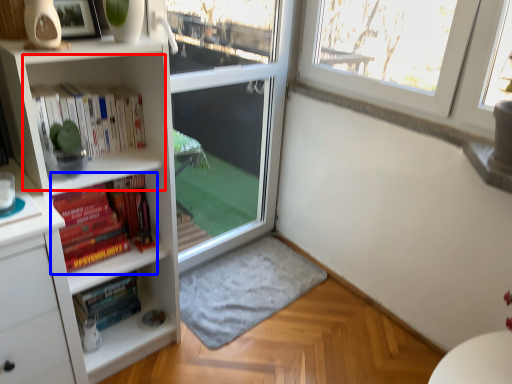
Question: Among these objects, which one is farthest to the camera, cabinet (highlighted by a red box) or book (highlighted by a blue box)?

Choices:
 (A) cabinet
 (B) book

Answer: (B)